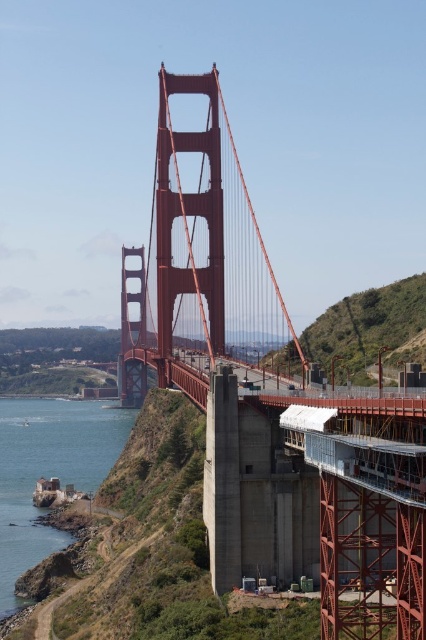
You are a surveyor measuring the Golden Gate Bridge. You have a coordinate point at (270, 401). What does this point represent?

The point at (270, 401) indicates the matte steel suspension bridge at center.

You are a drone operator planning to fly a drone from the clear blue water at lower left to the matte steel suspension bridge at center. What is the minimum distance you need to cover to reach the bridge?

The minimum distance you need to cover to reach the matte steel suspension bridge at center from the clear blue water at lower left is 47.80 meters.